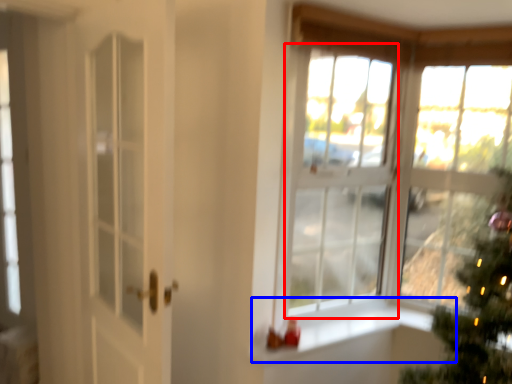
Question: Among these objects, which one is nearest to the camera, window (highlighted by a red box) or window sill (highlighted by a blue box)?

Choices:
 (A) window
 (B) window sill

Answer: (B)